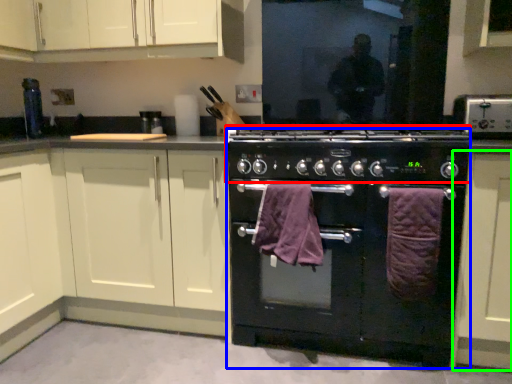
Question: Which is nearer to the appliance (highlighted by a red box)? home appliance (highlighted by a blue box) or cabinetry (highlighted by a green box).

Choices:
 (A) home appliance
 (B) cabinetry

Answer: (A)